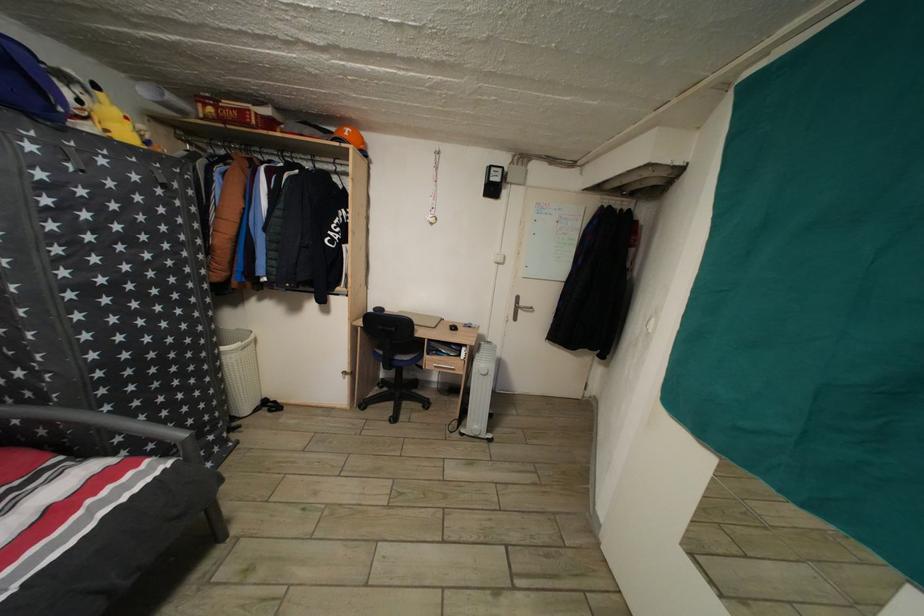
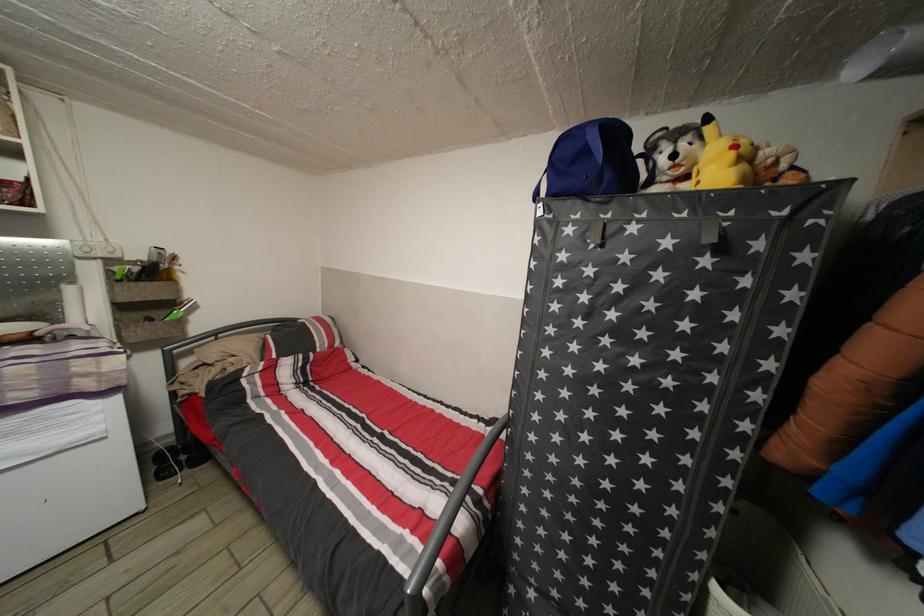
Where in the second image is the point corresponding to (110,168) from the first image?

(639, 235)